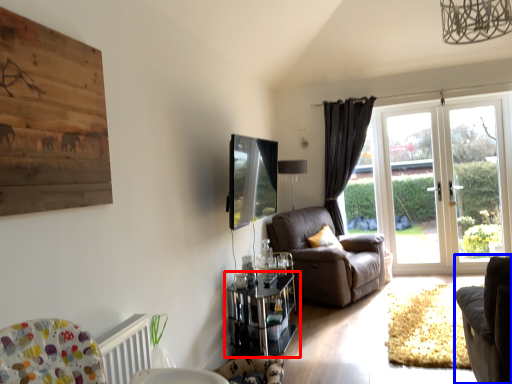
Question: Which of the following is the closest to the observer, table (highlighted by a red box) or chair (highlighted by a blue box)?

Choices:
 (A) table
 (B) chair

Answer: (B)